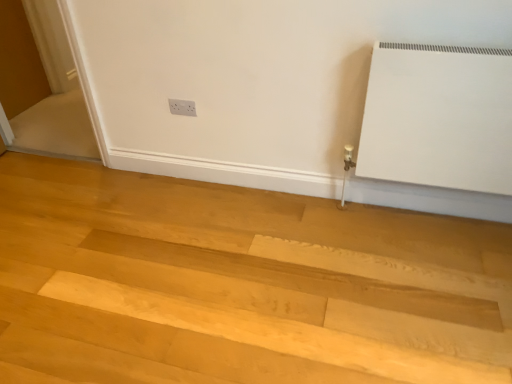
Question: In terms of width, does natural wood floor at lower center look wider or thinner when compared to white glossy screen door at left?

Choices:
 (A) wide
 (B) thin

Answer: (A)

Question: From a real-world perspective, is natural wood floor at lower center above or below white glossy screen door at left?

Choices:
 (A) above
 (B) below

Answer: (B)

Question: Which object is positioned closest to the white plastic electric outlet at upper center?

Choices:
 (A) natural wood floor at lower center
 (B) white glossy screen door at left

Answer: (A)

Question: Based on their relative distances, which object is farther from the white plastic electric outlet at upper center?

Choices:
 (A) white glossy screen door at left
 (B) natural wood floor at lower center

Answer: (A)